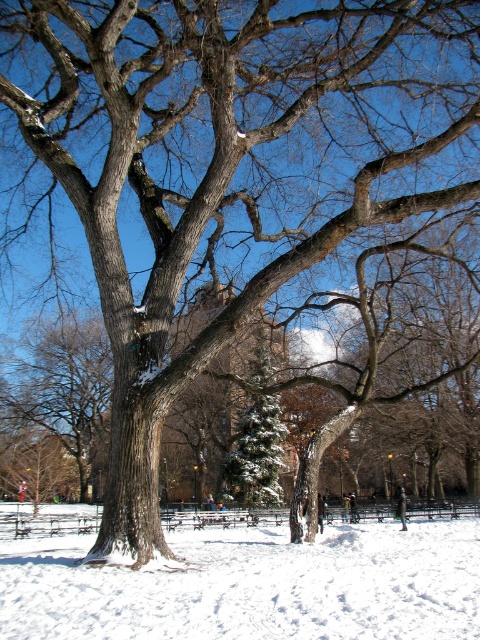
Question: Which object is closer to the camera taking this photo?

Choices:
 (A) white powdery snow at center
 (B) green snowy evergreen at center

Answer: (A)

Question: Does white powdery snow at center have a greater width compared to green snowy evergreen at center?

Choices:
 (A) no
 (B) yes

Answer: (B)

Question: Is white powdery snow at center above green snowy evergreen at center?

Choices:
 (A) yes
 (B) no

Answer: (B)

Question: Is white powdery snow at center further to camera compared to green snowy evergreen at center?

Choices:
 (A) yes
 (B) no

Answer: (B)

Question: Which of the following is the farthest from the observer?

Choices:
 (A) green snowy evergreen at center
 (B) white powdery snow at center

Answer: (A)

Question: Which of the following is the closest to the observer?

Choices:
 (A) green snowy evergreen at center
 (B) white powdery snow at center

Answer: (B)